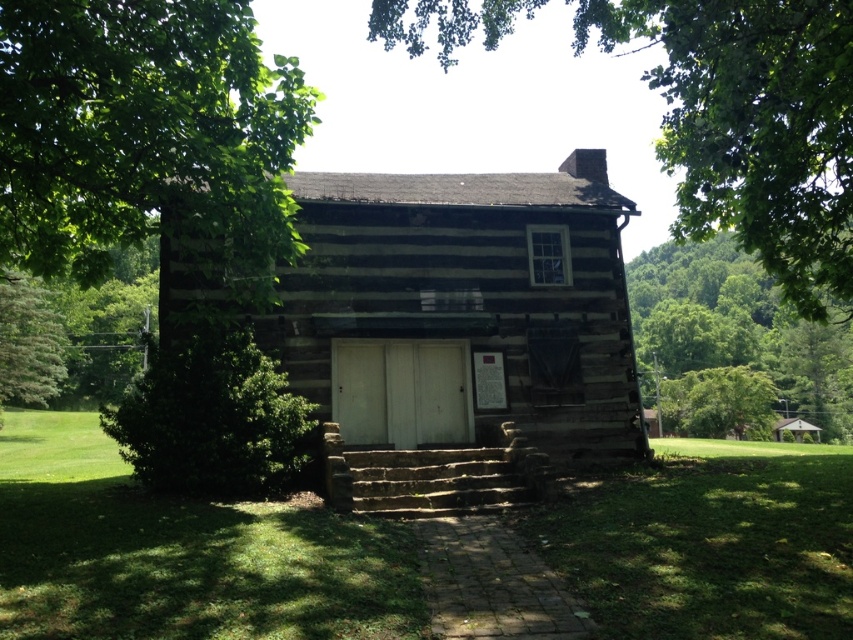
You are standing at the base of the log cabin and want to walk towards the entrance. There are two points marked on the ground. One is at point (13,83) and the other at point (791,390). Which point should you step on first to reach the entrance without going through the cabin?

You should step on point (13,83) first because it is in front of point (791,390), meaning it is closer to the entrance and does not require passing through the cabin.